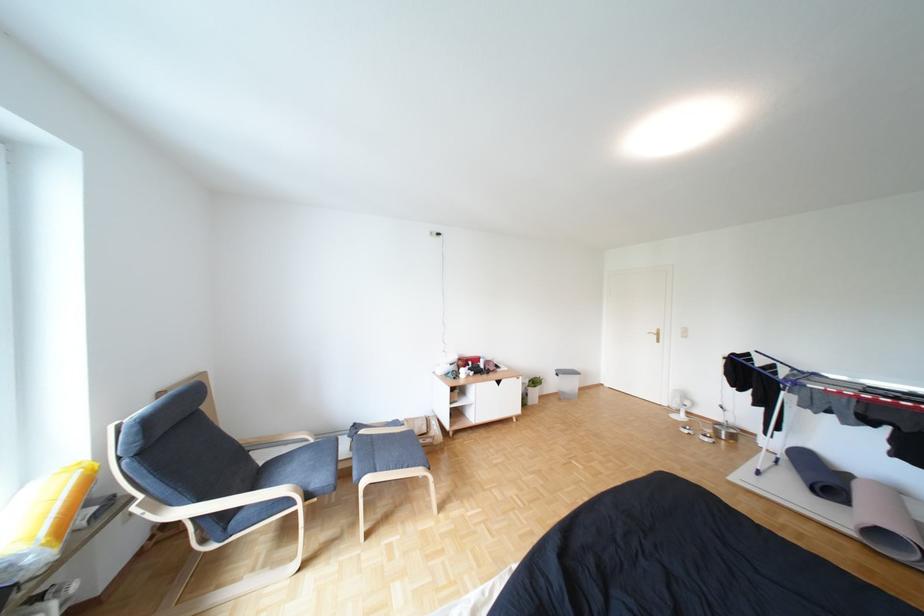
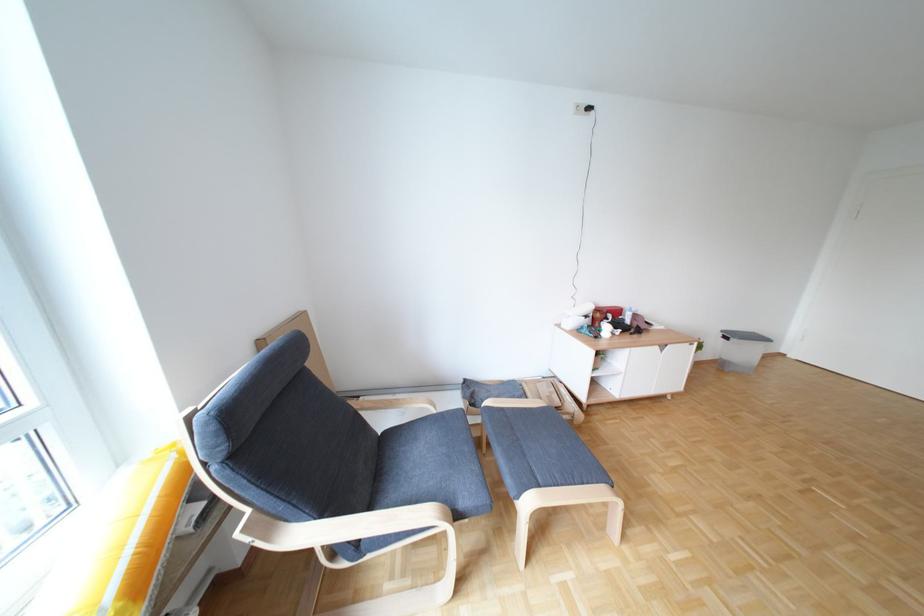
Locate, in the second image, the point that corresponds to pixel 391 472 in the first image.

(554, 485)